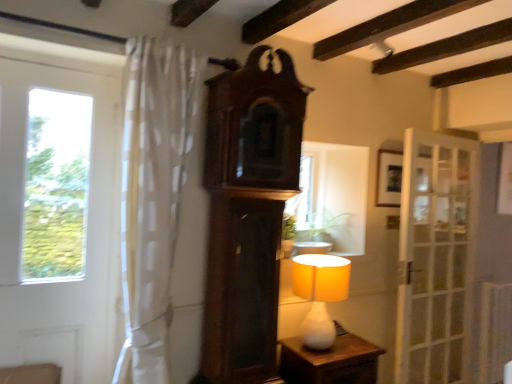
Question: Is green leafy plant at center closer to camera compared to white glass door at right, which is the second door from front to back?

Choices:
 (A) yes
 (B) no

Answer: (A)

Question: Are green leafy plant at center and white glass door at right, which is the second door from front to back, located far from each other?

Choices:
 (A) yes
 (B) no

Answer: (B)

Question: Is green leafy plant at center located outside white glass door at right, which is the second door from front to back?

Choices:
 (A) no
 (B) yes

Answer: (B)

Question: From a real-world perspective, does green leafy plant at center sit lower than white glass door at right, which is counted as the first door, starting from the right?

Choices:
 (A) yes
 (B) no

Answer: (B)

Question: Is green leafy plant at center beside white glass door at right, the first door viewed from the back?

Choices:
 (A) no
 (B) yes

Answer: (A)

Question: Considering the positions of white glass door at left, the second door positioned from the back, and wooden picture frame at upper right in the image, is white glass door at left, the second door positioned from the back, wider or thinner than wooden picture frame at upper right?

Choices:
 (A) wide
 (B) thin

Answer: (A)

Question: Considering their positions, is white glass door at left, arranged as the 2th door when viewed from the right, located in front of or behind wooden picture frame at upper right?

Choices:
 (A) behind
 (B) front

Answer: (B)

Question: Is white glass door at left, the first door viewed from the front, situated inside wooden picture frame at upper right or outside?

Choices:
 (A) inside
 (B) outside

Answer: (B)

Question: From a real-world perspective, is white glass door at left, placed as the 1th door when sorted from left to right, physically located above or below wooden picture frame at upper right?

Choices:
 (A) below
 (B) above

Answer: (A)

Question: Considering their positions, is white sheer curtain at left located in front of or behind wooden picture frame at upper right?

Choices:
 (A) behind
 (B) front

Answer: (B)

Question: In the image, is white sheer curtain at left on the left side or the right side of wooden picture frame at upper right?

Choices:
 (A) right
 (B) left

Answer: (B)

Question: From a real-world perspective, is white sheer curtain at left physically located above or below wooden picture frame at upper right?

Choices:
 (A) above
 (B) below

Answer: (B)

Question: Is point (135, 218) closer or farther from the camera than point (387, 178)?

Choices:
 (A) farther
 (B) closer

Answer: (B)

Question: In terms of size, does white glass door at left, the second door positioned from the back, appear bigger or smaller than white matte table lamp at center?

Choices:
 (A) big
 (B) small

Answer: (A)

Question: Considering the positions of white glass door at left, placed as the 1th door when sorted from left to right, and white matte table lamp at center in the image, is white glass door at left, placed as the 1th door when sorted from left to right, taller or shorter than white matte table lamp at center?

Choices:
 (A) short
 (B) tall

Answer: (B)